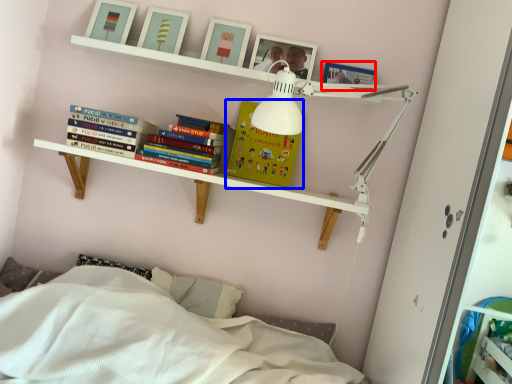
Question: Which object appears farthest to the camera in this image, picture frame (highlighted by a red box) or paperback book (highlighted by a blue box)?

Choices:
 (A) picture frame
 (B) paperback book

Answer: (B)